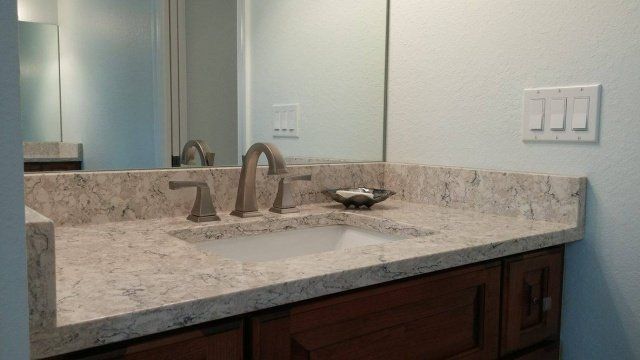
The image size is (640, 360). What are the coordinates of `cabinet handle` in the screenshot? It's located at (545, 306).